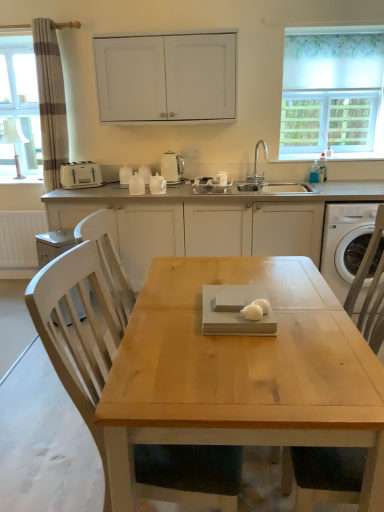
Question: Does white matte cabinet at upper center, the 2th cabinetry from the bottom, come behind white plastic washing machine at right?

Choices:
 (A) yes
 (B) no

Answer: (A)

Question: Is white matte cabinet at upper center, which is the 1th cabinetry in top-to-bottom order, positioned with its back to white plastic washing machine at right?

Choices:
 (A) yes
 (B) no

Answer: (B)

Question: From the image's perspective, is white matte cabinet at upper center, the 2th cabinetry from the bottom, over white plastic washing machine at right?

Choices:
 (A) no
 (B) yes

Answer: (B)

Question: Is white matte cabinet at upper center, the 2th cabinetry from the bottom, facing towards white plastic washing machine at right?

Choices:
 (A) yes
 (B) no

Answer: (B)

Question: From a real-world perspective, is white matte cabinet at upper center, which is the 1th cabinetry in top-to-bottom order, physically above white plastic washing machine at right?

Choices:
 (A) no
 (B) yes

Answer: (B)

Question: Does white matte cabinet at upper center, the 2th cabinetry from the bottom, have a lesser height compared to white plastic washing machine at right?

Choices:
 (A) no
 (B) yes

Answer: (B)

Question: Is white plastic dishwasher at lower left in contact with white plastic toaster at left?

Choices:
 (A) no
 (B) yes

Answer: (A)

Question: From a real-world perspective, is white plastic dishwasher at lower left below white plastic toaster at left?

Choices:
 (A) yes
 (B) no

Answer: (A)

Question: Would you say white plastic dishwasher at lower left is outside white plastic toaster at left?

Choices:
 (A) no
 (B) yes

Answer: (B)

Question: Is white plastic dishwasher at lower left closer to camera compared to white plastic toaster at left?

Choices:
 (A) no
 (B) yes

Answer: (B)

Question: From a real-world perspective, is white plastic dishwasher at lower left positioned over white plastic toaster at left based on gravity?

Choices:
 (A) yes
 (B) no

Answer: (B)

Question: Would you say white plastic toaster at left is part of white plastic dishwasher at lower left's contents?

Choices:
 (A) no
 (B) yes

Answer: (A)

Question: Can you confirm if white plastic dishwasher at lower left is thinner than light wood chair at center?

Choices:
 (A) yes
 (B) no

Answer: (A)